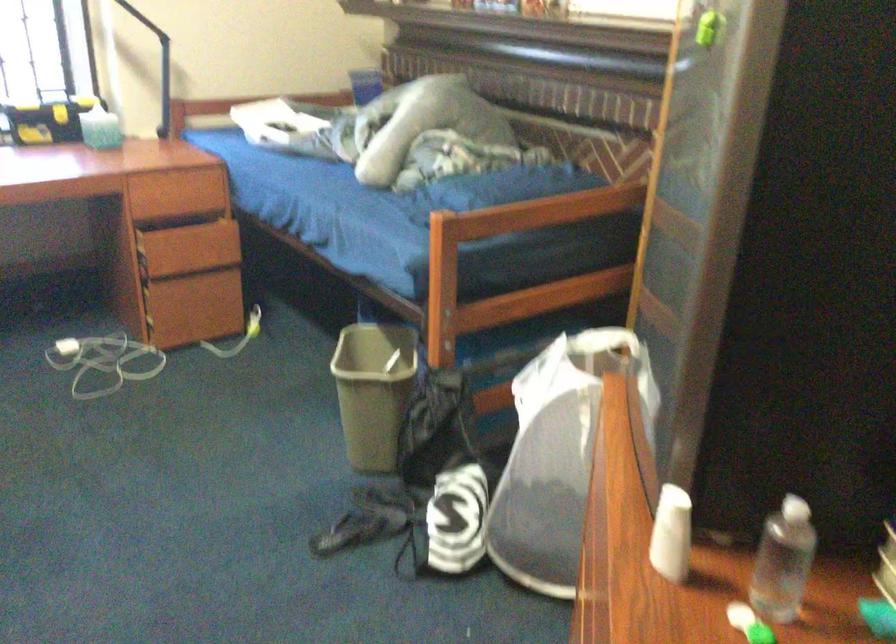
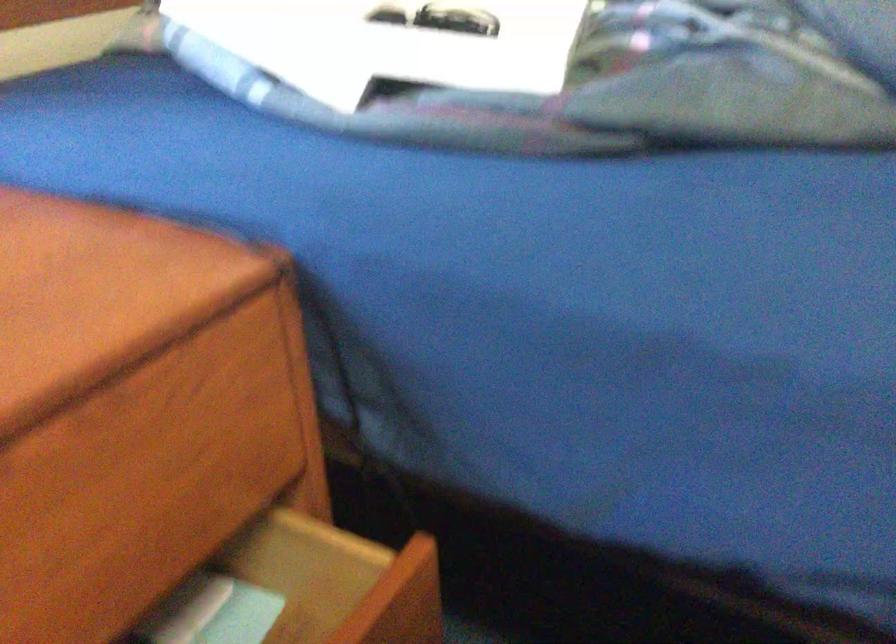
Question: Which direction would the cameraman need to move to produce the second image? Reply with the corresponding letter.

Choices:
 (A) Left
 (B) Right
 (C) Forward
 (D) Backward

Answer: (C)